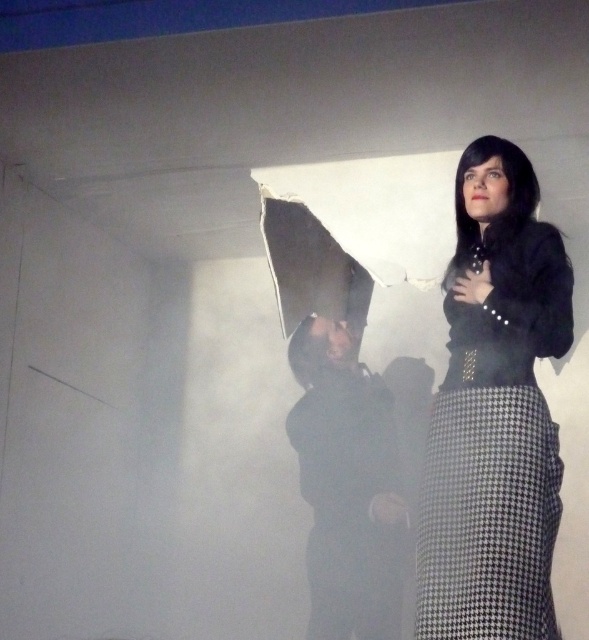
You are a photographer trying to focus on the black textured skirt at center and the black matte jacket at center in the image. Which object should you adjust your camera focus to first if you want to capture both in a single sharp image?

The black textured skirt at center is closer to the viewer than the black matte jacket at center. To capture both in a single sharp image, you should focus on the black textured skirt at center first, as it is closer, and the jacket will fall into focus due to the depth of field.

You are standing in the scene and want to reach the point at coordinates point (515,339). Given that your arm can reach up to 2.5 feet, can you touch the point without moving your feet?

The distance of point (515,339) from viewer is 8.15 feet, so no, you cannot touch it with your arm since it is farther than your reach.